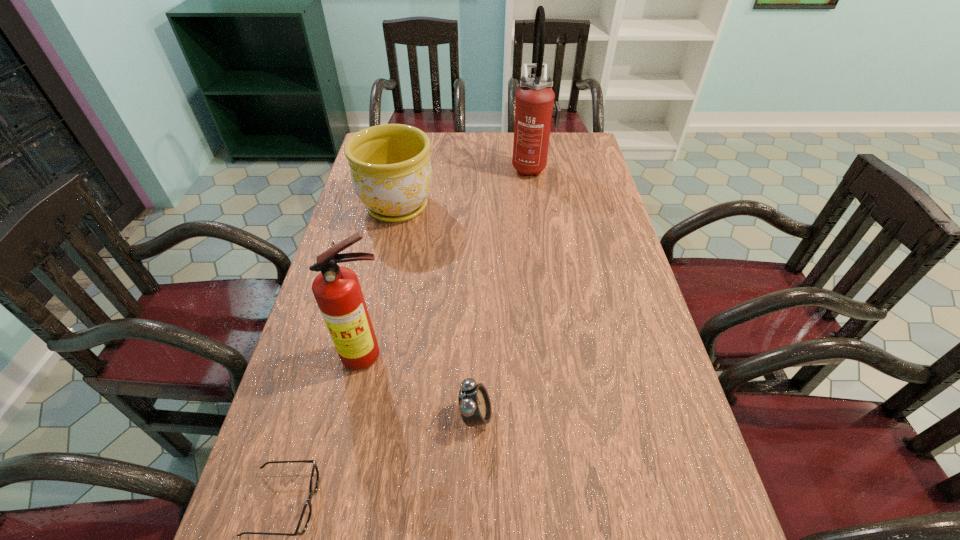
Locate an element on the screen. the rightmost object is located at coordinates (535, 108).

In order to click on the farther fire extinguisher in this screenshot , I will do `click(535, 108)`.

Find the location of a particular element. The height and width of the screenshot is (540, 960). the nearer fire extinguisher is located at coordinates (337, 291).

The width and height of the screenshot is (960, 540). In order to click on the third nearest object in this screenshot , I will do `click(337, 291)`.

Image resolution: width=960 pixels, height=540 pixels. I want to click on flowerpot, so click(390, 167).

You are a GUI agent. You are given a task and a screenshot of the screen. Output one action in this format:
    pyautogui.click(x=<x>, y=<y>)
    Task: Click on the fourth nearest object
    The height and width of the screenshot is (540, 960).
    Given the screenshot: What is the action you would take?
    pyautogui.click(x=390, y=167)

I want to click on the second nearest object, so click(x=474, y=403).

Find the location of a particular element. the fourth object from left to right is located at coordinates (474, 403).

Where is `vacant region located at the nozzle of the tallest object`? This screenshot has width=960, height=540. vacant region located at the nozzle of the tallest object is located at coordinates (487, 166).

This screenshot has height=540, width=960. I want to click on vacant space located at the nozzle of the tallest object, so click(425, 166).